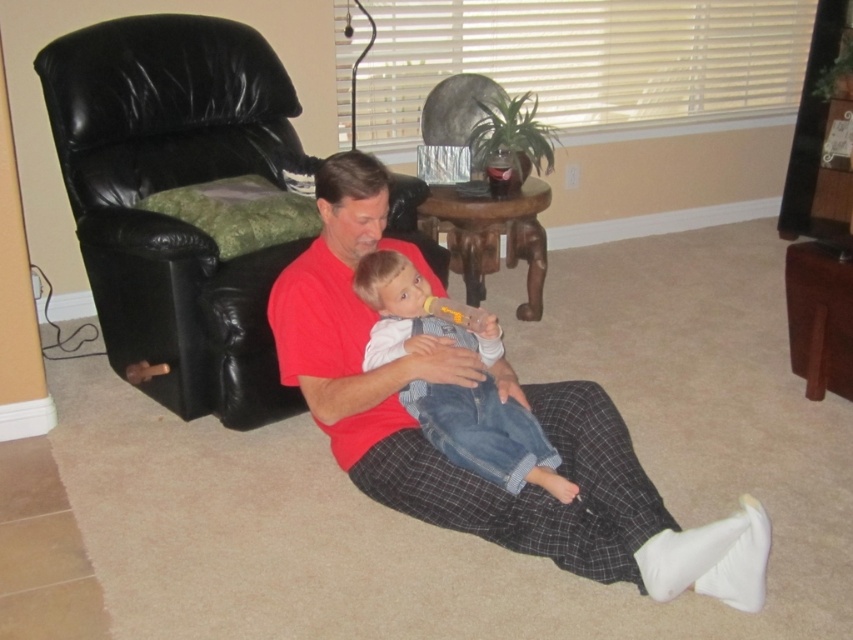
You are a delivery person trying to place a package on the surface between the red cotton shirt at center and the black leather armchair at left. Is there enough space to place the package there?

The red cotton shirt at center is below the black leather armchair at left, meaning there is no horizontal space between them for placing the package. The package cannot be placed there.

You are a delivery person who needs to place a small package on the floor between the red cotton shirt at center and the black leather armchair at left. Which object should you position the package closer to so that it remains within the visible frame of the image?

The red cotton shirt at center has a lesser height compared to the black leather armchair at left, so positioning the package closer to the red cotton shirt at center would keep it within the visible frame as it is shorter and less likely to block the view.

You are a visitor entering the living room and want to sit on the black leather armchair at left without disturbing the child in denim overalls at center. Is the path clear?

The denim overalls at center is behind the black leather armchair at left, so the path to the black leather armchair at left is clear. You can sit there without disturbing the child in denim overalls at center.